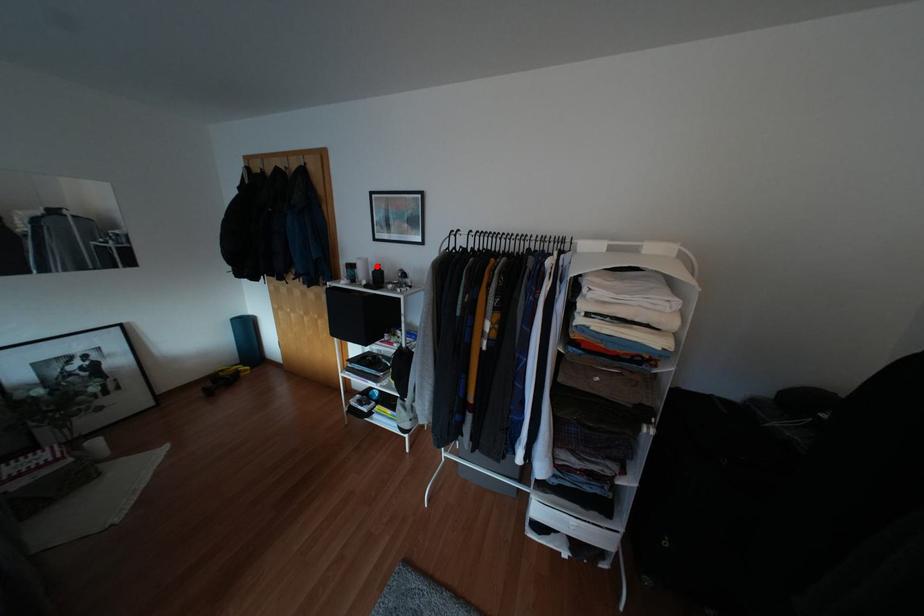
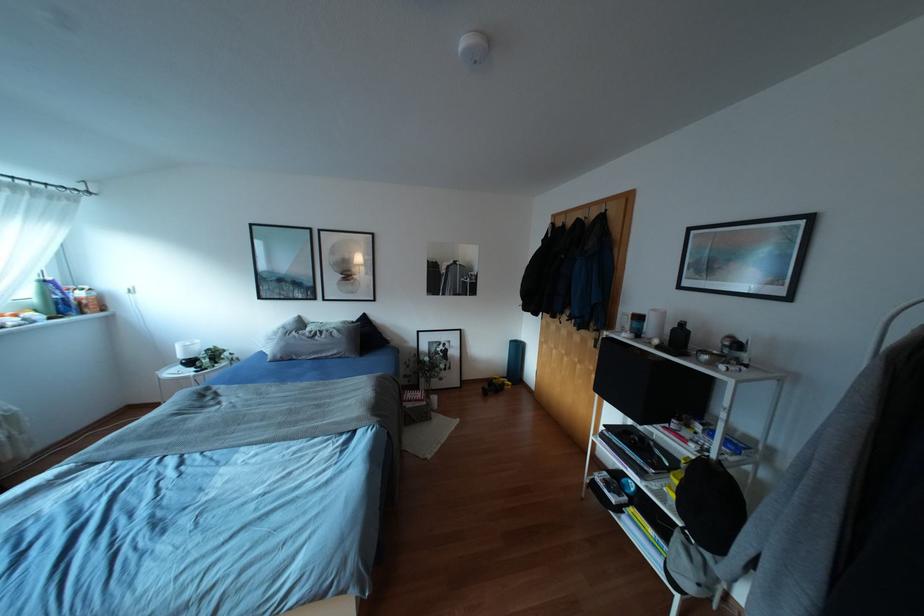
Find the pixel in the second image that matches the highlighted location in the first image.

(682, 323)